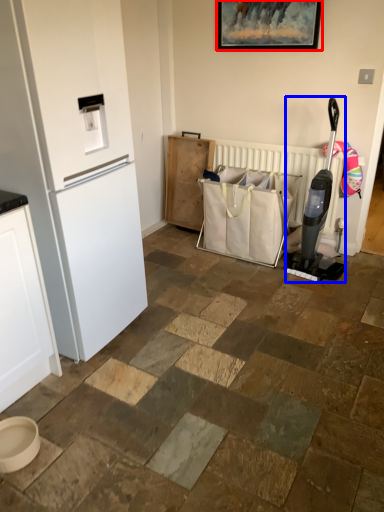
Question: Which of the following is the farthest to the observer, picture frame (highlighted by a red box) or appliance (highlighted by a blue box)?

Choices:
 (A) picture frame
 (B) appliance

Answer: (A)